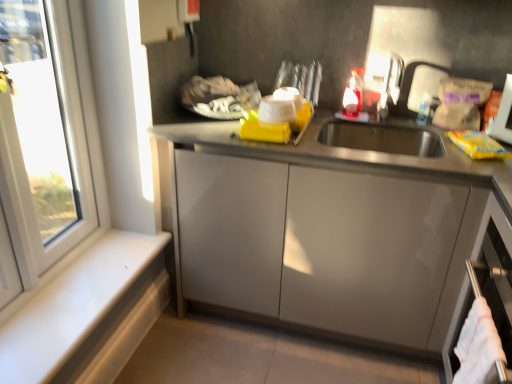
What is the approximate width of yellow matte packet at right?

It is 8.77 inches.

The image size is (512, 384). What are the coordinates of `white plastic window at left` in the screenshot? It's located at (48, 135).

This screenshot has height=384, width=512. Describe the element at coordinates (48, 135) in the screenshot. I see `white plastic window at left` at that location.

What is the approximate width of satin silver dishwasher at lower right?

satin silver dishwasher at lower right is 11.67 inches in width.

I want to click on satin nickel faucet at upper right, so click(x=390, y=84).

This screenshot has width=512, height=384. What do you see at coordinates (390, 84) in the screenshot? I see `satin nickel faucet at upper right` at bounding box center [390, 84].

This screenshot has height=384, width=512. Describe the element at coordinates (72, 304) in the screenshot. I see `white matte window sill at lower left` at that location.

This screenshot has width=512, height=384. I want to click on yellow matte packet at right, so click(x=478, y=144).

Is white matte window sill at lower left to the left of white plastic window at left from the viewer's perspective?

In fact, white matte window sill at lower left is to the right of white plastic window at left.

At what (x,y) coordinates should I click in order to perform the action: click on window sill behind the white plastic window at left. Please return your answer as a coordinate pair (x, y). This screenshot has width=512, height=384. Looking at the image, I should click on (x=72, y=304).

Does white matte window sill at lower left come behind white plastic window at left?

Yes, white matte window sill at lower left is further from the camera.

Could you tell me if white matte window sill at lower left is facing white plastic window at left?

No, white matte window sill at lower left does not turn towards white plastic window at left.

Can you confirm if yellow matte packet at right is bigger than white plastic window at left?

Incorrect, yellow matte packet at right is not larger than white plastic window at left.

From a real-world perspective, which is physically above, yellow matte packet at right or white plastic window at left?

In real-world perspective, yellow matte packet at right is above.

Is satin nickel faucet at upper right inside or outside of white matte window sill at lower left?

satin nickel faucet at upper right is located beyond the bounds of white matte window sill at lower left.

From the image's perspective, which is above, satin nickel faucet at upper right or white matte window sill at lower left?

satin nickel faucet at upper right.

Considering the sizes of objects satin nickel faucet at upper right and white matte window sill at lower left in the image provided, who is bigger, satin nickel faucet at upper right or white matte window sill at lower left?

white matte window sill at lower left is bigger.

Based on the photo, considering the sizes of objects satin nickel faucet at upper right and white cotton towel at lower right in the image provided, who is bigger, satin nickel faucet at upper right or white cotton towel at lower right?

With larger size is white cotton towel at lower right.

Image resolution: width=512 pixels, height=384 pixels. What are the coordinates of `laundry that is below the satin nickel faucet at upper right (from the image's perspective)` in the screenshot? It's located at (478, 347).

Can you confirm if satin nickel faucet at upper right is shorter than white cotton towel at lower right?

Indeed, satin nickel faucet at upper right has a lesser height compared to white cotton towel at lower right.

Is satin nickel faucet at upper right aimed at satin silver dishwasher at lower right?

No.

Can you confirm if satin nickel faucet at upper right is smaller than satin silver dishwasher at lower right?

Indeed, satin nickel faucet at upper right has a smaller size compared to satin silver dishwasher at lower right.

Are satin nickel faucet at upper right and satin silver dishwasher at lower right far apart?

satin nickel faucet at upper right is actually quite close to satin silver dishwasher at lower right.

Is satin nickel faucet at upper right at the left side of satin silver dishwasher at lower right?

Indeed, satin nickel faucet at upper right is positioned on the left side of satin silver dishwasher at lower right.

Can you tell me how much white cotton towel at lower right and satin nickel faucet at upper right differ in facing direction?

white cotton towel at lower right and satin nickel faucet at upper right are facing 96.2 degrees away from each other.

Consider the image. Which object is thinner, white cotton towel at lower right or satin nickel faucet at upper right?

white cotton towel at lower right is thinner.

The height and width of the screenshot is (384, 512). I want to click on laundry in front of the satin nickel faucet at upper right, so click(x=478, y=347).

Considering the sizes of objects white plastic window at left and yellow matte packet at right in the image provided, who is thinner, white plastic window at left or yellow matte packet at right?

white plastic window at left.

From a real-world perspective, does white plastic window at left stand above yellow matte packet at right?

No, from a real-world perspective, white plastic window at left is not above yellow matte packet at right.

Is point (106, 214) positioned after point (496, 142)?

That is True.

Considering the sizes of objects white plastic window at left and yellow matte packet at right in the image provided, who is bigger, white plastic window at left or yellow matte packet at right?

With larger size is white plastic window at left.

In the image, there is a white plastic window at left. What are the coordinates of `window sill below it (from the image's perspective)` in the screenshot? It's located at (72, 304).

What are the coordinates of `food above the white plastic window at left (from a real-world perspective)` in the screenshot? It's located at (478, 144).

From the image, which object appears to be farther from satin silver dishwasher at lower right, white plastic window at left or white cotton towel at lower right?

Based on the image, white plastic window at left appears to be further to satin silver dishwasher at lower right.

Looking at the image, which one is located further to yellow matte packet at right, white matte window sill at lower left or white plastic window at left?

Among the two, white plastic window at left is located further to yellow matte packet at right.

Based on their spatial positions, is satin silver dishwasher at lower right or white matte window sill at lower left further from white cotton towel at lower right?

Based on the image, white matte window sill at lower left appears to be further to white cotton towel at lower right.

When comparing their distances from satin nickel faucet at upper right, does white cotton towel at lower right or white matte window sill at lower left seem further?

white matte window sill at lower left.

Considering their positions, is white cotton towel at lower right positioned further to yellow matte packet at right than white plastic window at left?

Based on the image, white plastic window at left appears to be further to yellow matte packet at right.

Considering their positions, is white matte window sill at lower left positioned further to white plastic window at left than yellow matte packet at right?

yellow matte packet at right.

Based on their spatial positions, is satin nickel faucet at upper right or white cotton towel at lower right further from yellow matte packet at right?

Among the two, white cotton towel at lower right is located further to yellow matte packet at right.

When comparing their distances from satin nickel faucet at upper right, does white matte window sill at lower left or white plastic window at left seem closer?

The object closer to satin nickel faucet at upper right is white plastic window at left.

Locate an element on the screen. The height and width of the screenshot is (384, 512). dish washer that lies between satin nickel faucet at upper right and white cotton towel at lower right from top to bottom is located at coordinates (496, 267).

You are a GUI agent. You are given a task and a screenshot of the screen. Output one action in this format:
    pyautogui.click(x=<x>, y=<y>)
    Task: Click on the faucet between white matte window sill at lower left and satin silver dishwasher at lower right from left to right
    
    Given the screenshot: What is the action you would take?
    pyautogui.click(x=390, y=84)

Identify the location of dish washer between yellow matte packet at right and white cotton towel at lower right from top to bottom. (496, 267).

The width and height of the screenshot is (512, 384). In order to click on food between satin nickel faucet at upper right and satin silver dishwasher at lower right in the up-down direction in this screenshot , I will do `click(478, 144)`.